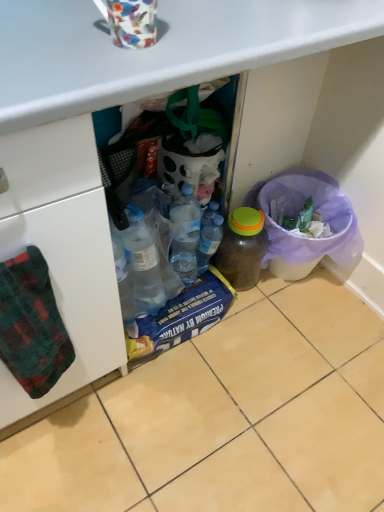
The image size is (384, 512). I want to click on vacant region to the left of floral-patterned ceramic mug at upper center, so click(x=50, y=32).